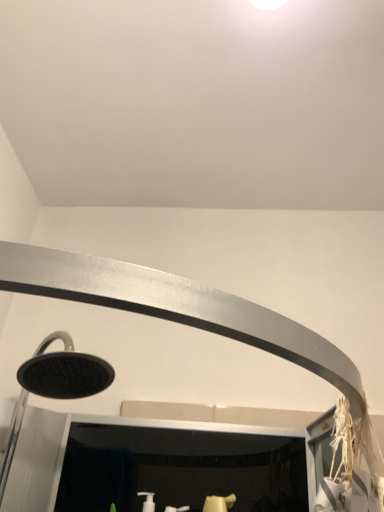
Measure the distance between black matte shower head at upper left and camera.

black matte shower head at upper left is 34.10 inches from camera.

Locate an element on the screen. This screenshot has width=384, height=512. black matte shower head at upper left is located at coordinates (54, 385).

Looking at this image, what is the approximate height of black matte shower head at upper left?

black matte shower head at upper left is 11.40 inches tall.

Describe the element at coordinates (54, 385) in the screenshot. I see `black matte shower head at upper left` at that location.

Identify the location of black matte shower head at upper left. (54, 385).